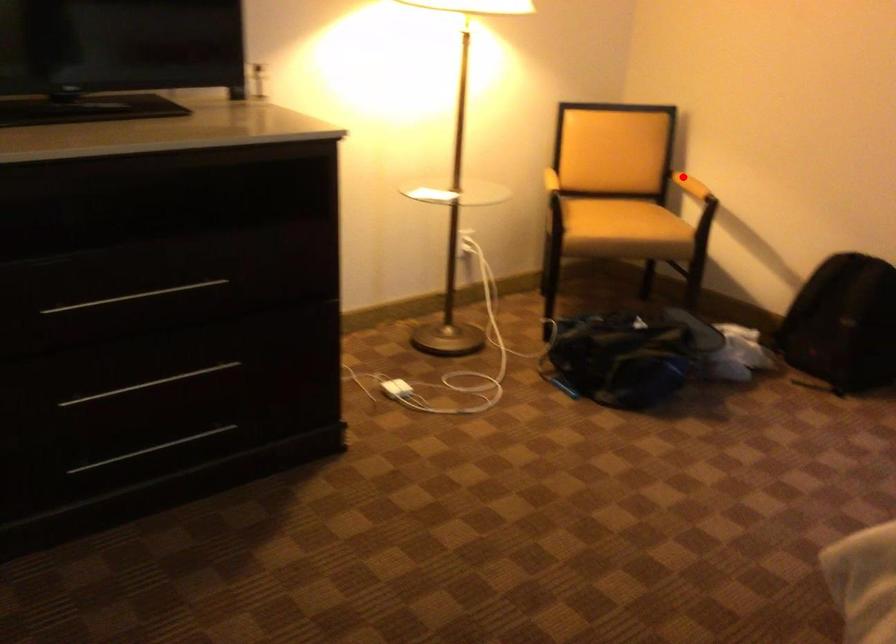
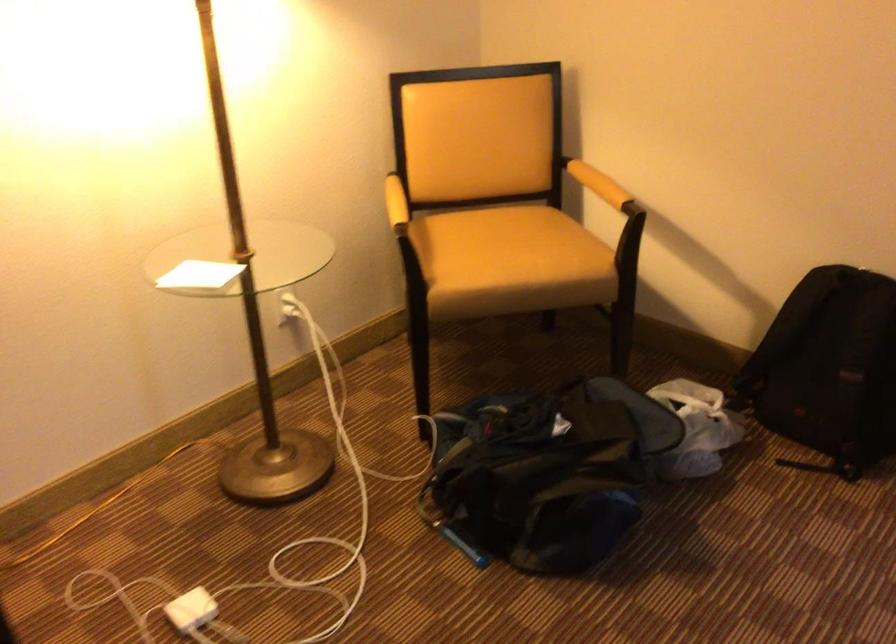
Question: I am providing you with two images of the same scene from different viewpoints. Image1 has a red point marked. In image2, the corresponding 3D location appears at what relative position? Reply with the corresponding letter.

Choices:
 (A) Closer
 (B) Farther

Answer: (A)